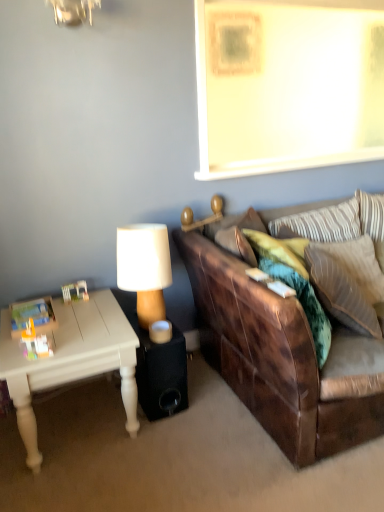
Question: Does striped fabric pillow at upper right, the 1th pillow positioned from the back, lie in front of velvet green pillow at right, positioned as the second pillow in front-to-back order?

Choices:
 (A) no
 (B) yes

Answer: (A)

Question: Considering the relative sizes of striped fabric pillow at upper right, the 1th pillow positioned from the back, and velvet green pillow at right, the second pillow from the back, in the image provided, is striped fabric pillow at upper right, the 1th pillow positioned from the back, smaller than velvet green pillow at right, the second pillow from the back,?

Choices:
 (A) yes
 (B) no

Answer: (A)

Question: From a real-world perspective, is striped fabric pillow at upper right, the 3th pillow in the front-to-back sequence, located beneath velvet green pillow at right, the second pillow from the back?

Choices:
 (A) yes
 (B) no

Answer: (B)

Question: Is striped fabric pillow at upper right, the 1th pillow positioned from the back, surrounding velvet green pillow at right, the second pillow from the back?

Choices:
 (A) yes
 (B) no

Answer: (B)

Question: From the image's perspective, is striped fabric pillow at upper right, the 1th pillow positioned from the back, located above velvet green pillow at right, the second pillow from the back?

Choices:
 (A) no
 (B) yes

Answer: (B)

Question: Is point (188, 227) positioned closer to the camera than point (344, 226)?

Choices:
 (A) farther
 (B) closer

Answer: (B)

Question: From the image's perspective, relative to striped fabric pillow at upper right, the 1th pillow positioned from the back, is wooden lampshade at upper center, positioned as the second lamp in left-to-right order, above or below?

Choices:
 (A) below
 (B) above

Answer: (B)

Question: Considering the positions of wooden lampshade at upper center, positioned as the second lamp in left-to-right order, and striped fabric pillow at upper right, the 1th pillow positioned from the back, in the image, is wooden lampshade at upper center, positioned as the second lamp in left-to-right order, bigger or smaller than striped fabric pillow at upper right, the 1th pillow positioned from the back,?

Choices:
 (A) big
 (B) small

Answer: (B)

Question: Considering the positions of wooden lampshade at upper center, which is the 1th lamp in right-to-left order, and striped fabric pillow at upper right, the 3th pillow in the front-to-back sequence, in the image, is wooden lampshade at upper center, which is the 1th lamp in right-to-left order, taller or shorter than striped fabric pillow at upper right, the 3th pillow in the front-to-back sequence,?

Choices:
 (A) short
 (B) tall

Answer: (A)

Question: Looking at their shapes, would you say white painted wood coffee table at lower left is wider or thinner than leather couch at right?

Choices:
 (A) thin
 (B) wide

Answer: (A)

Question: From a real-world perspective, is white painted wood coffee table at lower left positioned above or below leather couch at right?

Choices:
 (A) below
 (B) above

Answer: (A)

Question: Considering the relative positions of white painted wood coffee table at lower left and leather couch at right in the image provided, is white painted wood coffee table at lower left to the left or to the right of leather couch at right?

Choices:
 (A) right
 (B) left

Answer: (B)

Question: Considering the positions of white painted wood coffee table at lower left and leather couch at right in the image, is white painted wood coffee table at lower left taller or shorter than leather couch at right?

Choices:
 (A) tall
 (B) short

Answer: (B)

Question: Looking at their shapes, would you say wooden lampshade at center, arranged as the 1th lamp when ordered from the bottom, is wider or thinner than striped fabric pillow at upper right, the 3th pillow in the front-to-back sequence?

Choices:
 (A) wide
 (B) thin

Answer: (A)

Question: From the image's perspective, is wooden lampshade at center, the first lamp from the left, located above or below striped fabric pillow at upper right, the 1th pillow positioned from the back?

Choices:
 (A) below
 (B) above

Answer: (A)